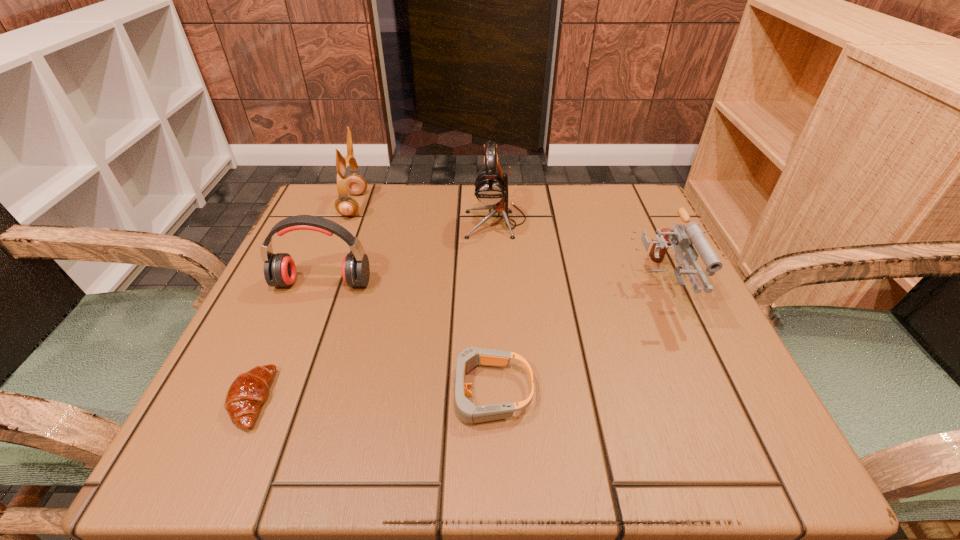
Locate an element on the screen. vacant space at the left edge of the desktop is located at coordinates (293, 296).

This screenshot has width=960, height=540. In the image, there is a desktop. In order to click on vacant space at the right edge in this screenshot , I will do `click(617, 252)`.

I want to click on free spot at the far left corner of the desktop, so click(354, 219).

In the image, there is a desktop. Find the location of `free space at the near right corner`. free space at the near right corner is located at coordinates (776, 462).

This screenshot has height=540, width=960. Find the location of `free space between the goggles and the rightmost object`. free space between the goggles and the rightmost object is located at coordinates (574, 339).

Where is `free area in between the goggles and the gun`? The image size is (960, 540). free area in between the goggles and the gun is located at coordinates (574, 339).

Identify the location of vacant space in between the goggles and the rightmost earphone. This screenshot has height=540, width=960. (492, 306).

Locate an element on the screen. unoccupied area between the nearest earphone and the goggles is located at coordinates (405, 338).

What are the coordinates of `vacant space that's between the goggles and the crescent roll` in the screenshot? It's located at (370, 396).

Identify which object is located as the fifth nearest to the gun. Please provide its 2D coordinates. Your answer should be formatted as a tuple, i.e. [(x, y)], where the tuple contains the x and y coordinates of a point satisfying the conditions above.

[(249, 390)]